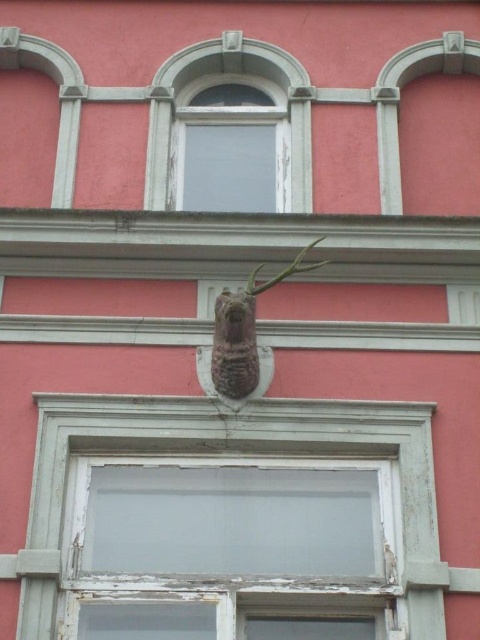
You are an architect inspecting the building facade. You notice the matte glass window at upper center and the rustic stone owl at center. Which object is closer to your current position?

The matte glass window at upper center is closer to you because it is further to the viewer than the rustic stone owl at center.

You are standing in front of the building facade and notice the matte glass window at upper center and the green wood branch at center. Which object is closer to you?

The matte glass window at upper center is closer to you because it is further to the viewer than the green wood branch at center.

You are a window cleaner standing on a ladder. You need to clean the matte glass window at upper center and the green wood branch at center. Which object should you clean first based on their positions?

The matte glass window at upper center should be cleaned first because it is positioned over the green wood branch at center, so cleaning it first prevents dirt from falling onto the branch below.